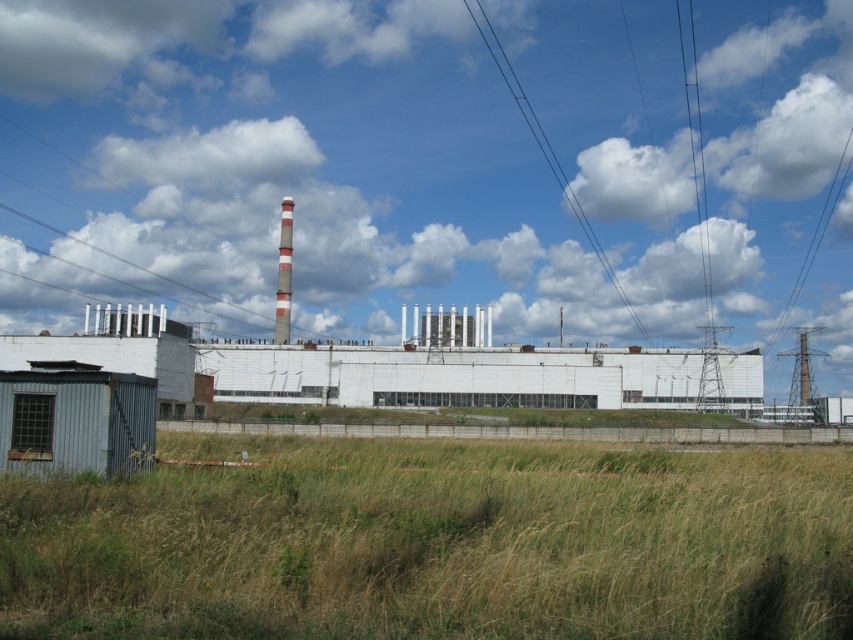
Is white fluffy cloud at upper left thinner than white striped chimney at center?

Incorrect, white fluffy cloud at upper left's width is not less than white striped chimney at center's.

Which is behind, point (134, 12) or point (286, 262)?

The point (134, 12) is behind.

You are a GUI agent. You are given a task and a screenshot of the screen. Output one action in this format:
    pyautogui.click(x=<x>, y=<y>)
    Task: Click on the white fluffy cloud at upper left
    Image resolution: width=853 pixels, height=640 pixels.
    Given the screenshot: What is the action you would take?
    pyautogui.click(x=100, y=44)

Can you confirm if green grass at lower left is positioned to the left of white fluffy cloud at upper left?

No, green grass at lower left is not to the left of white fluffy cloud at upper left.

Which is in front, point (112, 584) or point (67, 19)?

Point (112, 584) is more forward.

Between point (352, 504) and point (22, 51), which one is positioned behind?

The point (22, 51) is behind.

At what (x,y) coordinates should I click in order to perform the action: click on green grass at lower left. Please return your answer as a coordinate pair (x, y). The height and width of the screenshot is (640, 853). Looking at the image, I should click on (434, 541).

Can you confirm if white fluffy cloud at upper center is positioned to the left of white fluffy cloud at upper left?

Incorrect, white fluffy cloud at upper center is not on the left side of white fluffy cloud at upper left.

Between white fluffy cloud at upper center and white fluffy cloud at upper left, which one appears on the left side from the viewer's perspective?

white fluffy cloud at upper left is more to the left.

The width and height of the screenshot is (853, 640). What do you see at coordinates (431, 164) in the screenshot?
I see `white fluffy cloud at upper center` at bounding box center [431, 164].

You are a GUI agent. You are given a task and a screenshot of the screen. Output one action in this format:
    pyautogui.click(x=<x>, y=<y>)
    Task: Click on the white fluffy cloud at upper center
    The height and width of the screenshot is (640, 853).
    Given the screenshot: What is the action you would take?
    pyautogui.click(x=431, y=164)